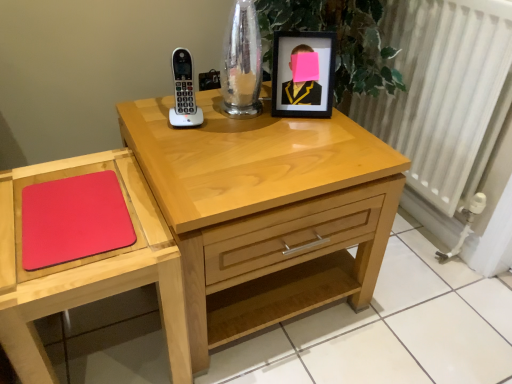
I want to click on unoccupied area behind white plastic phone at upper center, so click(200, 102).